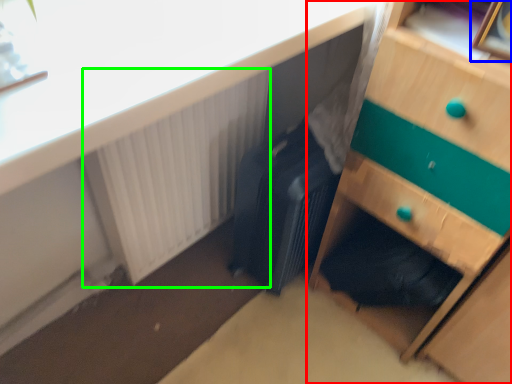
Question: Based on their relative distances, which object is farther from chest of drawers (highlighted by a red box)? Choose from picture frame (highlighted by a blue box) and radiator (highlighted by a green box).

Choices:
 (A) picture frame
 (B) radiator

Answer: (B)